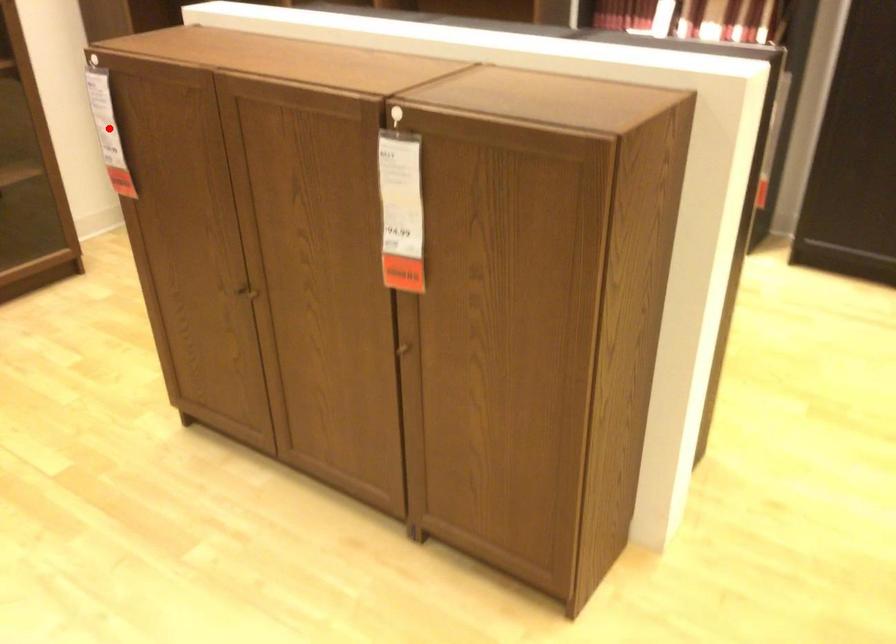
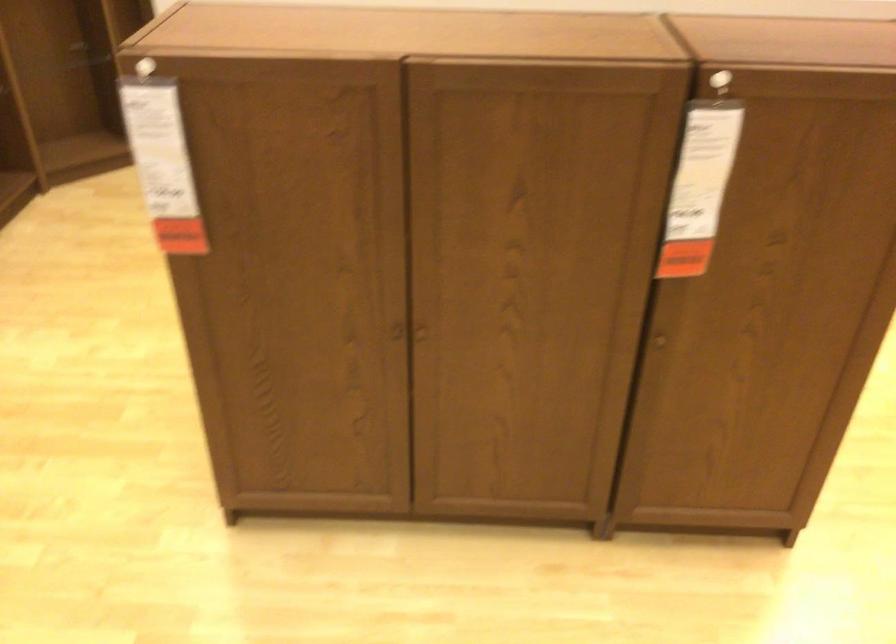
Where in the second image is the point corresponding to the highlighted location from the first image?

(162, 164)